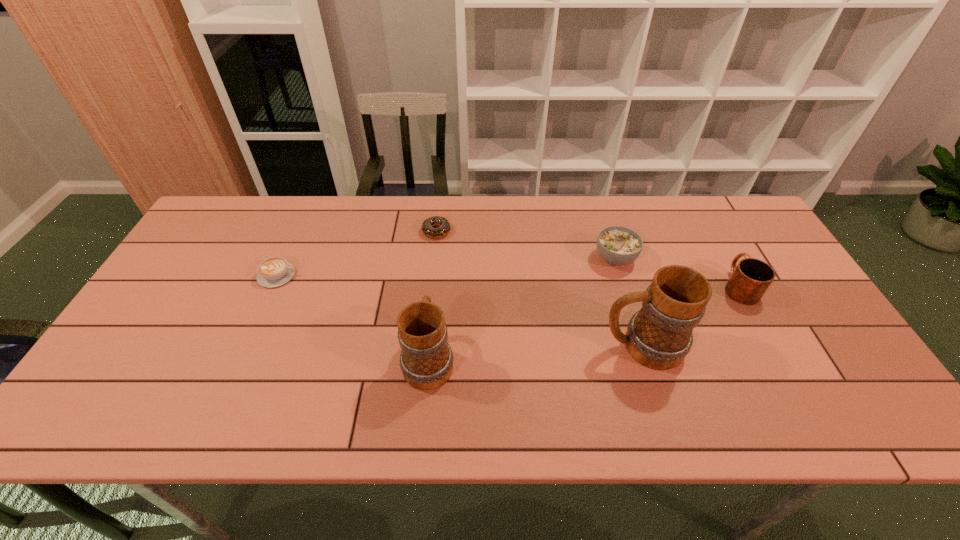
Locate an element on the screen. vacant area that lies between the doughnut and the cappuccino is located at coordinates (357, 253).

In order to click on free spot between the leftmost mug and the doughnut in this screenshot , I will do `click(433, 295)`.

You are a GUI agent. You are given a task and a screenshot of the screen. Output one action in this format:
    pyautogui.click(x=<x>, y=<y>)
    Task: Click on the free space between the fifth shortest object and the tallest object
    The width and height of the screenshot is (960, 540).
    Given the screenshot: What is the action you would take?
    pyautogui.click(x=536, y=353)

You are a GUI agent. You are given a task and a screenshot of the screen. Output one action in this format:
    pyautogui.click(x=<x>, y=<y>)
    Task: Click on the third closest object to the tallest mug
    Image resolution: width=960 pixels, height=540 pixels.
    Given the screenshot: What is the action you would take?
    pyautogui.click(x=426, y=360)

The width and height of the screenshot is (960, 540). Find the location of `the third closest object to the second tallest mug`. the third closest object to the second tallest mug is located at coordinates (275, 271).

The width and height of the screenshot is (960, 540). Identify the location of mug that stands as the second closest to the rightmost object. (426, 360).

Identify the location of the second closest mug to the fifth tallest object. Image resolution: width=960 pixels, height=540 pixels. (659, 336).

At what (x,y) coordinates should I click in order to perform the action: click on free location that satisfies the following two spatial constraints: 1. on the side of the leftmost object with the handle; 2. on the side of the shortest mug with the handle. Please return your answer as a coordinate pair (x, y). Looking at the image, I should click on (273, 287).

At what (x,y) coordinates should I click in order to perform the action: click on vacant space that satisfies the following two spatial constraints: 1. on the side of the leftmost object with the handle; 2. on the side of the rightmost mug with the handle. Please return your answer as a coordinate pair (x, y). The width and height of the screenshot is (960, 540). Looking at the image, I should click on (273, 287).

Find the location of a particular element. free point that satisfies the following two spatial constraints: 1. on the side of the second tallest object with the handle; 2. on the left side of the soup bowl is located at coordinates (439, 258).